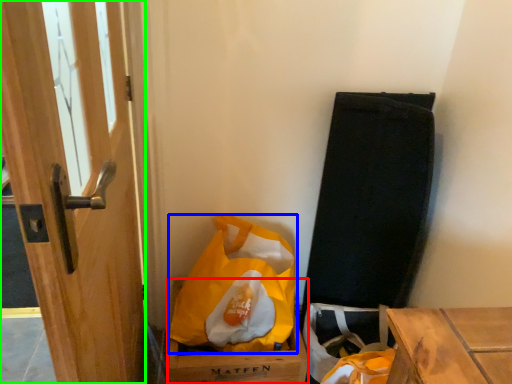
Question: Estimate the real-world distances between objects in this image. Which object is closer to cardboard box (highlighted by a red box), plastic bag (highlighted by a blue box) or door (highlighted by a green box)?

Choices:
 (A) plastic bag
 (B) door

Answer: (A)